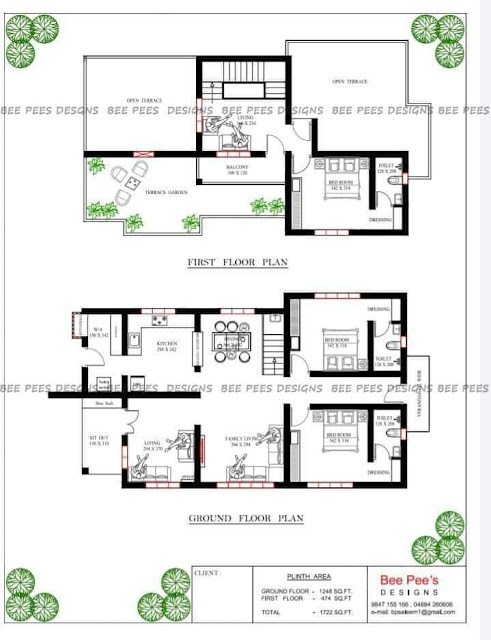
Identify the location of floorplan. (105, 287).